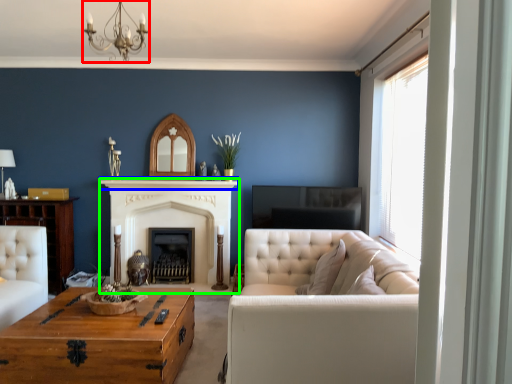
Question: Which object is the closest to the light fixture (highlighted by a red box)? Choose among these: mantle (highlighted by a blue box) or fireplace (highlighted by a green box).

Choices:
 (A) mantle
 (B) fireplace

Answer: (A)